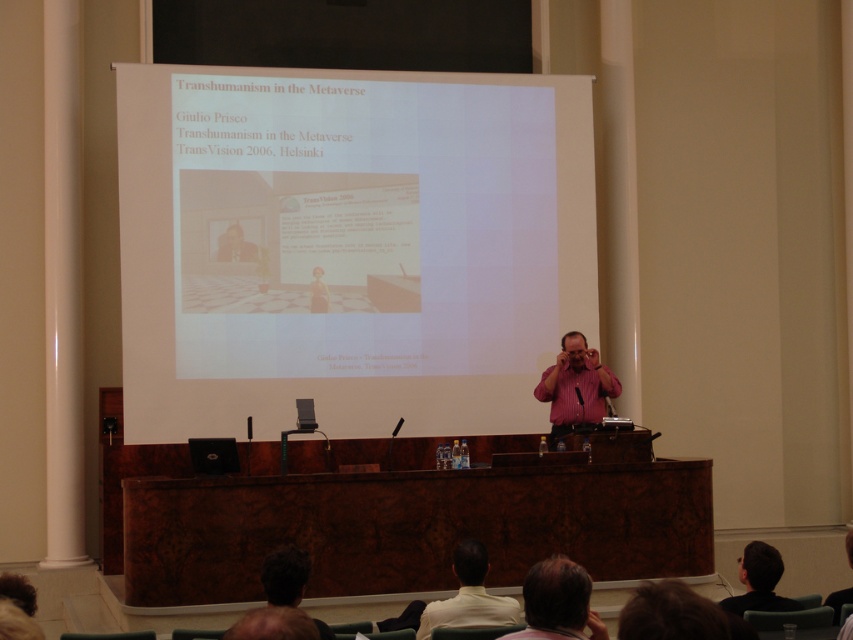
Question: Which point appears farthest from the camera in this image?

Choices:
 (A) (479, 582)
 (B) (583, 344)
 (C) (531, 260)
 (D) (550, 563)

Answer: (C)

Question: Which point is farther to the camera?

Choices:
 (A) (323, 364)
 (B) (584, 582)

Answer: (A)

Question: Is white matte projector screen at upper center behind light beige shirt at lower center?

Choices:
 (A) no
 (B) yes

Answer: (B)

Question: Is light beige shirt at lower center below dark brown hair at lower right?

Choices:
 (A) no
 (B) yes

Answer: (B)

Question: Is white matte projector screen at upper center bigger than pink shirt at center?

Choices:
 (A) yes
 (B) no

Answer: (A)

Question: Considering the real-world distances, which object is closest to the pink shirt at center?

Choices:
 (A) white matte projector screen at upper center
 (B) light brown hair at lower center
 (C) light beige shirt at lower center
 (D) dark brown hair at lower right

Answer: (A)